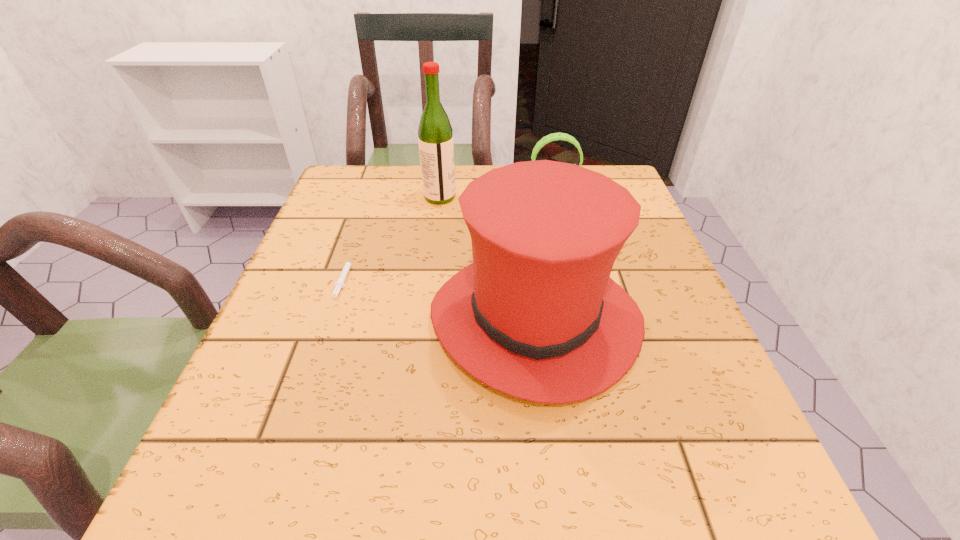
The width and height of the screenshot is (960, 540). I want to click on blank space at the near right corner, so click(x=664, y=529).

Where is `free spot between the third tallest object and the shortest object`? Image resolution: width=960 pixels, height=540 pixels. free spot between the third tallest object and the shortest object is located at coordinates pyautogui.click(x=448, y=234).

The width and height of the screenshot is (960, 540). I want to click on free space that is in between the liquor and the leftmost object, so click(392, 237).

Locate which object ranks second in proximity to the headset. Please provide its 2D coordinates. Your answer should be formatted as a tuple, i.e. [(x, y)], where the tuple contains the x and y coordinates of a point satisfying the conditions above.

[(536, 316)]

Find the location of `object that is the nearest to the hat`. object that is the nearest to the hat is located at coordinates (339, 284).

This screenshot has width=960, height=540. In order to click on vacant space that satisfies the following two spatial constraints: 1. on the back side of the headset; 2. on the left side of the shortest object in this screenshot , I will do `click(372, 192)`.

Find the location of a particular element. This screenshot has height=540, width=960. vacant space that satisfies the following two spatial constraints: 1. on the label of the second tallest object; 2. on the left side of the tallest object is located at coordinates (424, 319).

The width and height of the screenshot is (960, 540). What are the coordinates of `free space that satisfies the following two spatial constraints: 1. on the front side of the leftmost object; 2. on the right side of the third shortest object` in the screenshot? It's located at (329, 319).